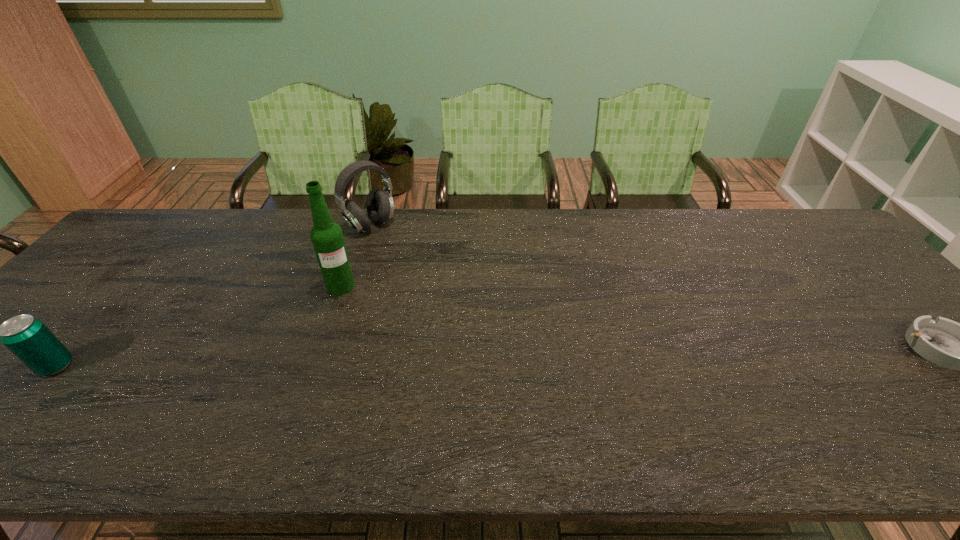
The image size is (960, 540). What are the coordinates of `beer can` in the screenshot? It's located at (29, 339).

The height and width of the screenshot is (540, 960). Find the location of `the leftmost object`. the leftmost object is located at coordinates (29, 339).

Find the location of a particular element. the second farthest object is located at coordinates (327, 238).

Find the location of a particular element. the tallest object is located at coordinates (327, 238).

Image resolution: width=960 pixels, height=540 pixels. I want to click on the farthest object, so click(380, 207).

What are the coordinates of `the third shortest object` in the screenshot? It's located at (380, 207).

Locate an element on the screen. This screenshot has width=960, height=540. free point located on the right of the leftmost object is located at coordinates (216, 366).

Locate an element on the screen. The image size is (960, 540). blank space located on the label of the beer bottle is located at coordinates (392, 401).

Where is `vacant space located 0.160m on the label of the beer bottle`? The width and height of the screenshot is (960, 540). vacant space located 0.160m on the label of the beer bottle is located at coordinates (362, 335).

The image size is (960, 540). What are the coordinates of `vacant area located 0.210m on the label of the beer bottle` in the screenshot? It's located at (369, 349).